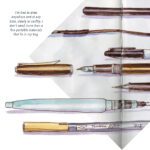
You are a GUI agent. You are given a task and a screenshot of the screen. Output one action in this format:
    pyautogui.click(x=<x>, y=<y>)
    Task: Click on the cap hook
    This screenshot has width=150, height=150.
    Given the screenshot: What is the action you would take?
    pyautogui.click(x=50, y=62), pyautogui.click(x=126, y=48)